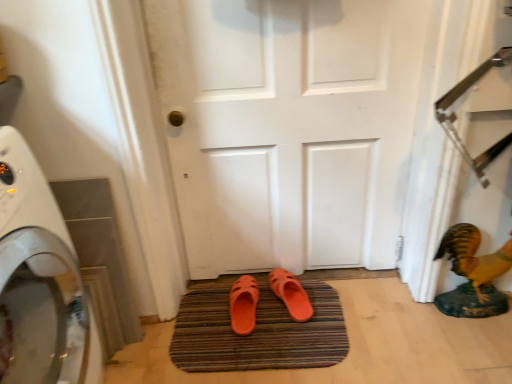
Question: Is orange rubber bath mat at center oriented away from white matte door at center?

Choices:
 (A) yes
 (B) no

Answer: (B)

Question: Would you say orange rubber bath mat at center is a long distance from white matte door at center?

Choices:
 (A) yes
 (B) no

Answer: (B)

Question: From the image's perspective, is orange rubber bath mat at center under white matte door at center?

Choices:
 (A) no
 (B) yes

Answer: (B)

Question: Is orange rubber bath mat at center located outside white matte door at center?

Choices:
 (A) yes
 (B) no

Answer: (A)

Question: From a real-world perspective, is orange rubber bath mat at center positioned under white matte door at center based on gravity?

Choices:
 (A) no
 (B) yes

Answer: (B)

Question: Would you say shiny gold statue at lower right is inside or outside orange rubber bath mat at center?

Choices:
 (A) inside
 (B) outside

Answer: (B)

Question: Based on their sizes in the image, would you say shiny gold statue at lower right is bigger or smaller than orange rubber bath mat at center?

Choices:
 (A) big
 (B) small

Answer: (A)

Question: From a real-world perspective, is shiny gold statue at lower right above or below orange rubber bath mat at center?

Choices:
 (A) above
 (B) below

Answer: (A)

Question: Relative to orange rubber bath mat at center, is shiny gold statue at lower right in front or behind?

Choices:
 (A) front
 (B) behind

Answer: (A)

Question: From a real-world perspective, is orange rubber bath mat at center above or below shiny gold statue at lower right?

Choices:
 (A) below
 (B) above

Answer: (A)

Question: From the image's perspective, relative to shiny gold statue at lower right, is orange rubber bath mat at center above or below?

Choices:
 (A) below
 (B) above

Answer: (A)

Question: Would you say orange rubber bath mat at center is to the left or to the right of shiny gold statue at lower right in the picture?

Choices:
 (A) left
 (B) right

Answer: (A)

Question: Would you say orange rubber bath mat at center is inside or outside shiny gold statue at lower right?

Choices:
 (A) inside
 (B) outside

Answer: (B)

Question: Is point (40, 258) closer or farther from the camera than point (391, 157)?

Choices:
 (A) closer
 (B) farther

Answer: (B)

Question: Considering their positions, is white glossy washing machine at left located in front of or behind white matte door at center?

Choices:
 (A) behind
 (B) front

Answer: (B)